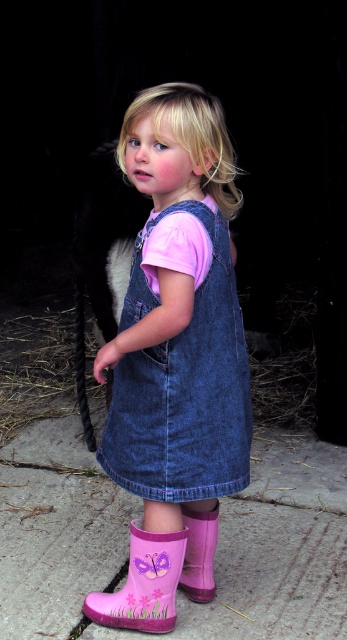
From the picture: Can you confirm if pink rubber boot at lower left is bigger than pink rubber boot at lower center?

Indeed, pink rubber boot at lower left has a larger size compared to pink rubber boot at lower center.

Does pink rubber boot at lower left have a greater width compared to pink rubber boot at lower center?

Yes, pink rubber boot at lower left is wider than pink rubber boot at lower center.

Between point (165, 632) and point (189, 554), which one is positioned in front?

Point (165, 632)

Find the location of a particular element. The height and width of the screenshot is (640, 347). pink rubber boot at lower left is located at coordinates (144, 582).

Does pink rubber boots at lower center have a lesser width compared to pink rubber boot at lower center?

No, pink rubber boots at lower center is not thinner than pink rubber boot at lower center.

Between pink rubber boots at lower center and pink rubber boot at lower center, which one is positioned lower?

pink rubber boot at lower center

Describe the element at coordinates (174, 348) in the screenshot. The image size is (347, 640). I see `pink rubber boots at lower center` at that location.

Find the location of a particular element. The width and height of the screenshot is (347, 640). pink rubber boots at lower center is located at coordinates (174, 348).

How distant is pink rubber boots at lower center from pink rubber boot at lower left?

They are 10.18 inches apart.

Which of these two, pink rubber boots at lower center or pink rubber boot at lower left, stands shorter?

pink rubber boot at lower left is shorter.

Is point (180, 554) farther from camera compared to point (167, 552)?

Yes, point (180, 554) is farther from viewer.

You are a GUI agent. You are given a task and a screenshot of the screen. Output one action in this format:
    pyautogui.click(x=<x>, y=<y>)
    Task: Click on the pink rubber boots at lower center
    The image size is (347, 640).
    Given the screenshot: What is the action you would take?
    pyautogui.click(x=174, y=348)